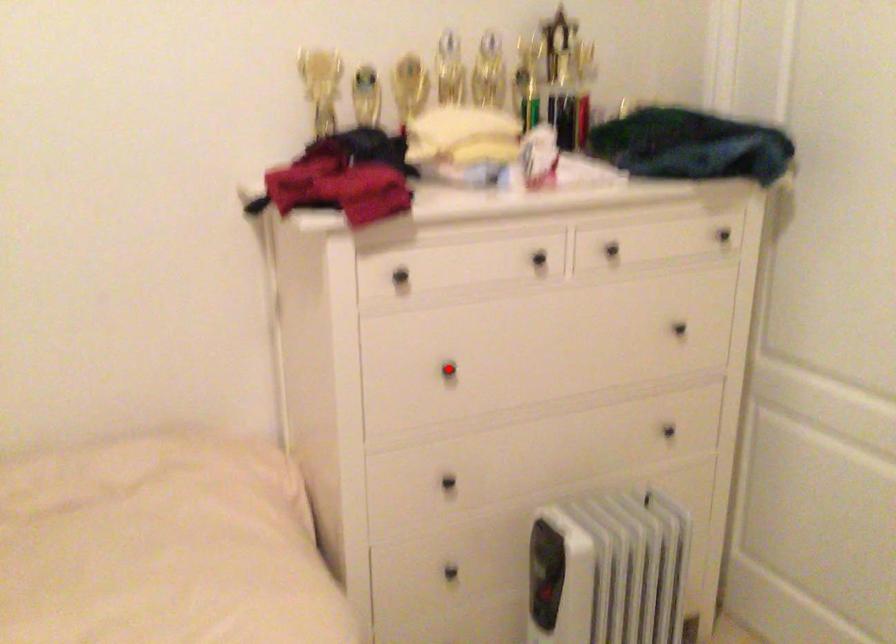
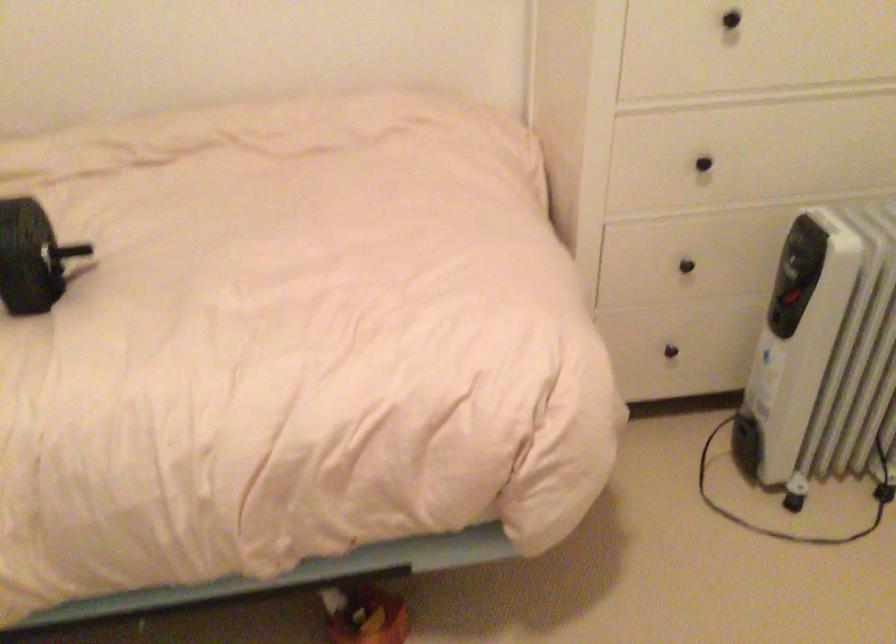
The point at the highlighted location is marked in the first image. Where is the corresponding point in the second image?

(730, 19)